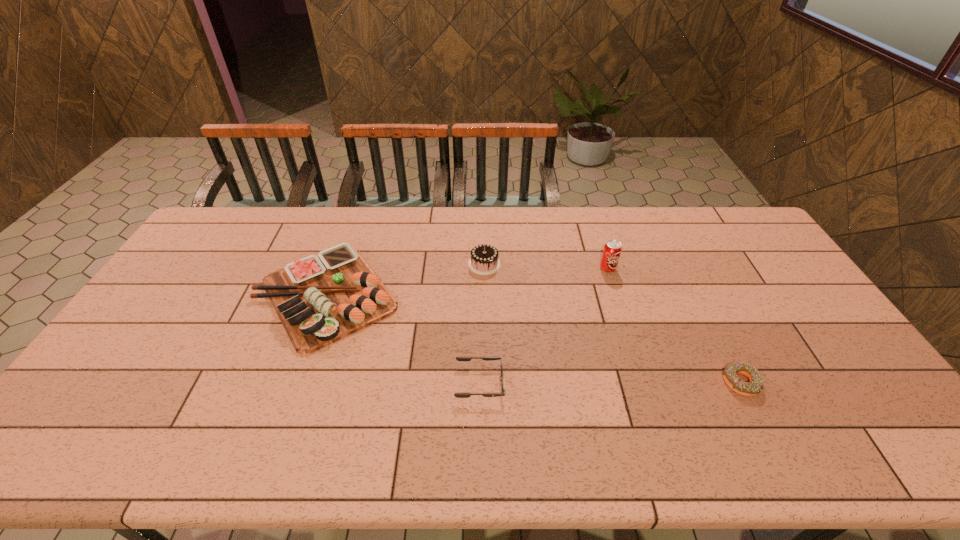
Where is `vacant region located 0.170m on the back of the doughnut`? Image resolution: width=960 pixels, height=540 pixels. vacant region located 0.170m on the back of the doughnut is located at coordinates (709, 319).

This screenshot has width=960, height=540. Identify the location of free space located 0.240m on the temples of the sunglasses. (597, 383).

In the image, there is a desktop. At what (x,y) coordinates should I click in order to perform the action: click on vacant space at the far edge. Please return your answer as a coordinate pair (x, y). This screenshot has width=960, height=540. Looking at the image, I should click on (655, 233).

In the image, there is a desktop. Identify the location of vacant space at the near edge. (797, 457).

Locate an element on the screen. This screenshot has width=960, height=540. vacant region at the left edge of the desktop is located at coordinates (128, 341).

You are a GUI agent. You are given a task and a screenshot of the screen. Output one action in this format:
    pyautogui.click(x=<x>, y=<y>)
    Task: Click on the free point between the sunglasses and the platter
    The image size is (960, 540).
    Given the screenshot: What is the action you would take?
    click(x=403, y=339)

In order to click on empty space between the doughnut and the chocolate cake in this screenshot , I will do `click(612, 323)`.

Where is `unoccupied area between the sunglasses and the second tallest object`? Image resolution: width=960 pixels, height=540 pixels. unoccupied area between the sunglasses and the second tallest object is located at coordinates (482, 323).

Locate an element on the screen. vacant space in between the second tallest object and the leftmost object is located at coordinates (405, 280).

At what (x,y) coordinates should I click in order to perform the action: click on free spot between the second tallest object and the tallest object. Please return your answer as a coordinate pair (x, y). Image resolution: width=960 pixels, height=540 pixels. Looking at the image, I should click on (546, 266).